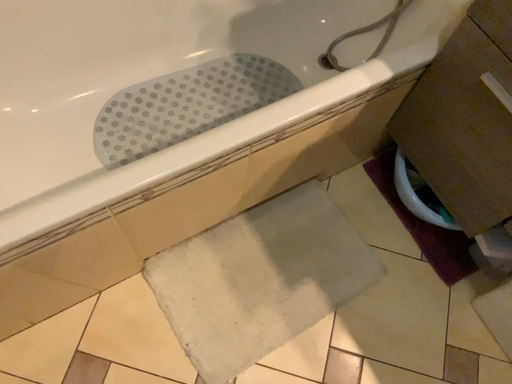
Question: Is white glossy toilet bowl at lower right closer to the viewer compared to purple fabric bath mat at lower right, positioned as the first bath mat in right-to-left order?

Choices:
 (A) yes
 (B) no

Answer: (A)

Question: Is white glossy toilet bowl at lower right facing away from purple fabric bath mat at lower right, acting as the 2th bath mat starting from the left?

Choices:
 (A) yes
 (B) no

Answer: (B)

Question: From a real-world perspective, does white glossy toilet bowl at lower right stand above purple fabric bath mat at lower right, positioned as the first bath mat in right-to-left order?

Choices:
 (A) no
 (B) yes

Answer: (B)

Question: Considering the relative sizes of white glossy toilet bowl at lower right and purple fabric bath mat at lower right, acting as the 2th bath mat starting from the left, in the image provided, is white glossy toilet bowl at lower right taller than purple fabric bath mat at lower right, acting as the 2th bath mat starting from the left,?

Choices:
 (A) no
 (B) yes

Answer: (B)

Question: Considering the relative positions of white glossy toilet bowl at lower right and purple fabric bath mat at lower right, positioned as the first bath mat in right-to-left order, in the image provided, is white glossy toilet bowl at lower right behind purple fabric bath mat at lower right, positioned as the first bath mat in right-to-left order,?

Choices:
 (A) no
 (B) yes

Answer: (A)

Question: Looking at their shapes, would you say white rubber mat at upper center is wider or thinner than purple fabric bath mat at lower right, acting as the 2th bath mat starting from the left?

Choices:
 (A) wide
 (B) thin

Answer: (A)

Question: In the image, is white rubber mat at upper center on the left side or the right side of purple fabric bath mat at lower right, acting as the 2th bath mat starting from the left?

Choices:
 (A) left
 (B) right

Answer: (A)

Question: From the image's perspective, is white rubber mat at upper center positioned above or below purple fabric bath mat at lower right, positioned as the first bath mat in right-to-left order?

Choices:
 (A) above
 (B) below

Answer: (A)

Question: Which is correct: white rubber mat at upper center is inside purple fabric bath mat at lower right, acting as the 2th bath mat starting from the left, or outside of it?

Choices:
 (A) inside
 (B) outside

Answer: (B)

Question: Relative to white glossy toilet bowl at lower right, is white soft bath mat at lower center, which ranks as the first bath mat in left-to-right order, in front or behind?

Choices:
 (A) front
 (B) behind

Answer: (A)

Question: Is white soft bath mat at lower center, positioned as the 2th bath mat in right-to-left order, taller or shorter than white glossy toilet bowl at lower right?

Choices:
 (A) short
 (B) tall

Answer: (A)

Question: Is point (287, 218) positioned closer to the camera than point (399, 190)?

Choices:
 (A) closer
 (B) farther

Answer: (A)

Question: Considering the relative positions of white soft bath mat at lower center, which ranks as the first bath mat in left-to-right order, and white glossy toilet bowl at lower right in the image provided, is white soft bath mat at lower center, which ranks as the first bath mat in left-to-right order, to the left or to the right of white glossy toilet bowl at lower right?

Choices:
 (A) right
 (B) left

Answer: (B)

Question: Considering the positions of white glossy toilet bowl at lower right and white soft bath mat at lower center, which ranks as the first bath mat in left-to-right order, in the image, is white glossy toilet bowl at lower right taller or shorter than white soft bath mat at lower center, which ranks as the first bath mat in left-to-right order,?

Choices:
 (A) tall
 (B) short

Answer: (A)

Question: Relative to white soft bath mat at lower center, positioned as the 2th bath mat in right-to-left order, is white glossy toilet bowl at lower right in front or behind?

Choices:
 (A) front
 (B) behind

Answer: (B)